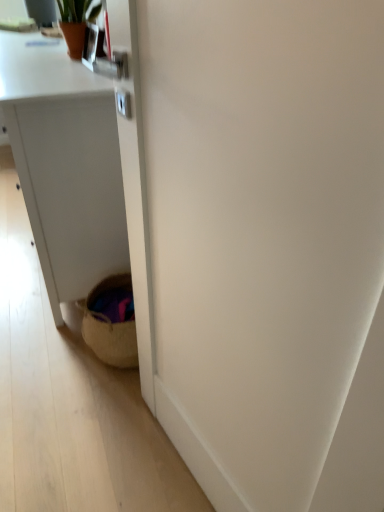
Question: From a real-world perspective, is woven basket at lower left physically below white matte desk at lower left?

Choices:
 (A) yes
 (B) no

Answer: (B)

Question: Is woven basket at lower left located outside white matte desk at lower left?

Choices:
 (A) no
 (B) yes

Answer: (B)

Question: Would you say woven basket at lower left contains white matte desk at lower left?

Choices:
 (A) no
 (B) yes

Answer: (A)

Question: From a real-world perspective, is woven basket at lower left located higher than white matte desk at lower left?

Choices:
 (A) no
 (B) yes

Answer: (B)

Question: Is the depth of woven basket at lower left greater than that of white matte desk at lower left?

Choices:
 (A) yes
 (B) no

Answer: (B)

Question: Can you confirm if woven basket at lower left is shorter than white matte desk at lower left?

Choices:
 (A) yes
 (B) no

Answer: (B)

Question: Can you confirm if terracotta pot at upper left is bigger than white matte desk at lower left?

Choices:
 (A) no
 (B) yes

Answer: (A)

Question: From the image's perspective, does terracotta pot at upper left appear higher than white matte desk at lower left?

Choices:
 (A) yes
 (B) no

Answer: (A)

Question: Is terracotta pot at upper left smaller than white matte desk at lower left?

Choices:
 (A) no
 (B) yes

Answer: (B)

Question: Can you confirm if terracotta pot at upper left is taller than white matte desk at lower left?

Choices:
 (A) no
 (B) yes

Answer: (A)

Question: Considering the relative sizes of terracotta pot at upper left and white matte desk at lower left in the image provided, is terracotta pot at upper left thinner than white matte desk at lower left?

Choices:
 (A) no
 (B) yes

Answer: (B)

Question: From a real-world perspective, is terracotta pot at upper left beneath white matte desk at lower left?

Choices:
 (A) no
 (B) yes

Answer: (A)

Question: Is terracotta pot at upper left bigger than woven basket at lower left?

Choices:
 (A) no
 (B) yes

Answer: (A)